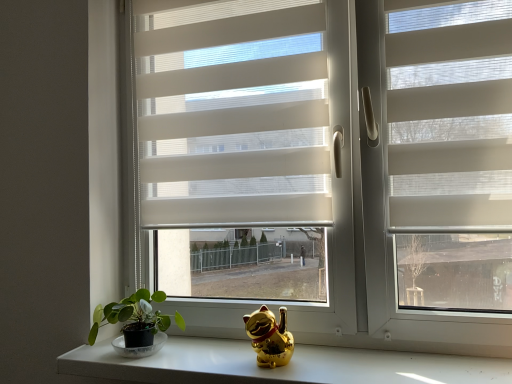
At what (x,y) coordinates should I click in order to perform the action: click on vacant area located to the right-hand side of gold shiny cat at center. Please return your answer as a coordinate pair (x, y). This screenshot has width=512, height=384. Looking at the image, I should click on (333, 361).